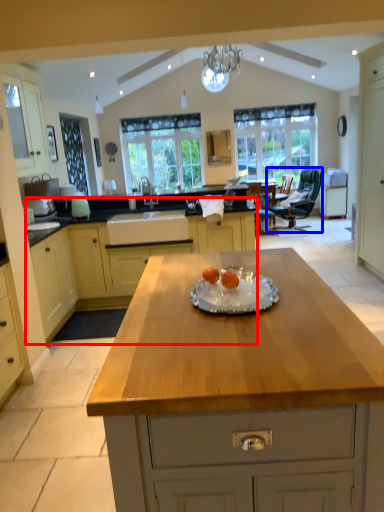
Question: Which object is closer to the camera taking this photo, cabinetry (highlighted by a red box) or chair (highlighted by a blue box)?

Choices:
 (A) cabinetry
 (B) chair

Answer: (A)